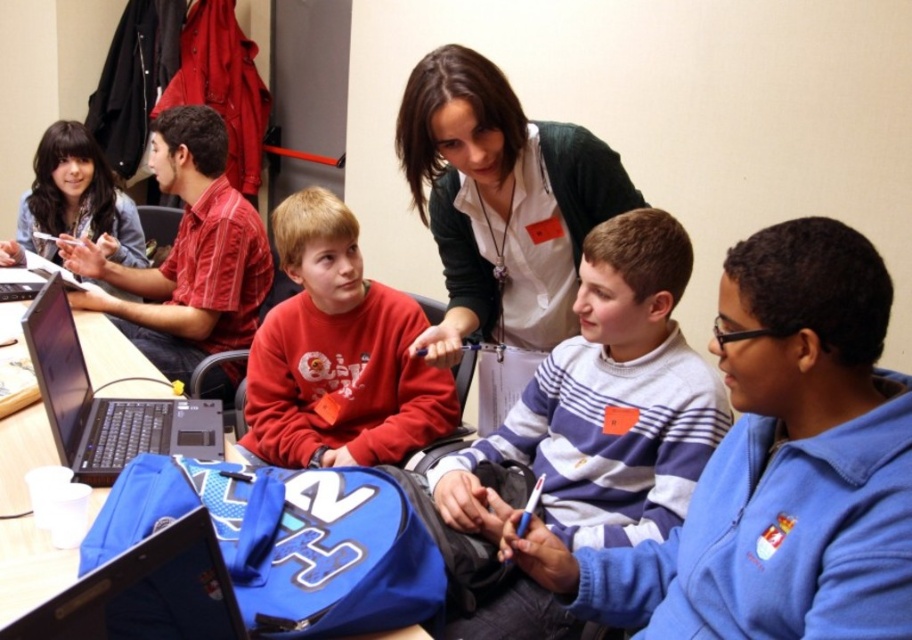
You are a delivery robot that needs to place a package on the table between the white shirt at center and the shiny black laptop at lower left. The package is 1 meter long. Can you fit it there?

The distance between the white shirt at center and the shiny black laptop at lower left is 99.58 centimeters. Since the package is 1 meter long, it is slightly too long to fit in the available space.

You are trying to place a new object on the table between the matte red sweatshirt at center and the black matte laptop at left. Based on their widths, can you determine if there is enough space for it?

The matte red sweatshirt at center might be wider than the black matte laptop at left, so there may not be enough space between them for the new object.